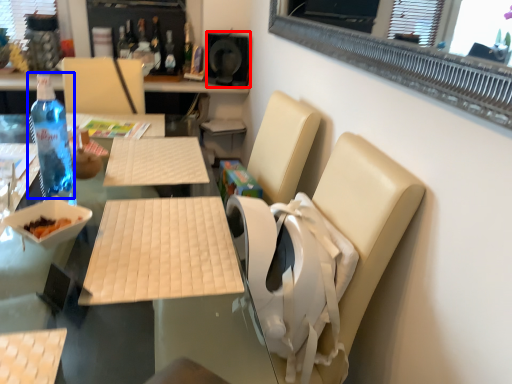
Question: Among these objects, which one is nearest to the camera, speaker (highlighted by a red box) or bottle (highlighted by a blue box)?

Choices:
 (A) speaker
 (B) bottle

Answer: (B)